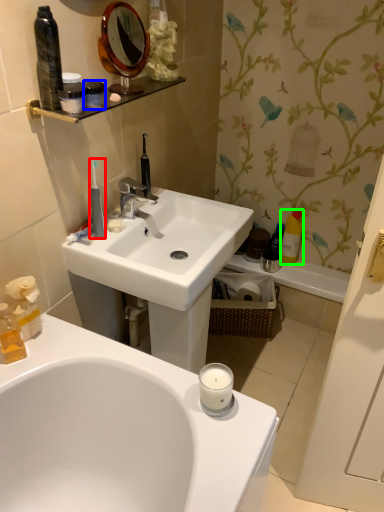
Question: Based on their relative distances, which object is nearer to toothbrush (highlighted by a red box)? Choose from mouthwash (highlighted by a blue box) and mouthwash (highlighted by a green box).

Choices:
 (A) mouthwash
 (B) mouthwash

Answer: (A)